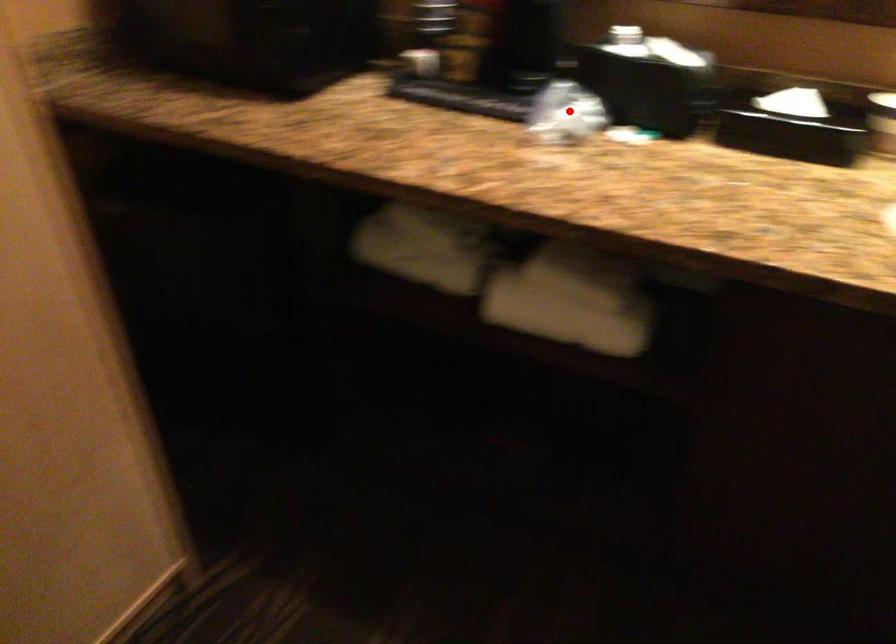
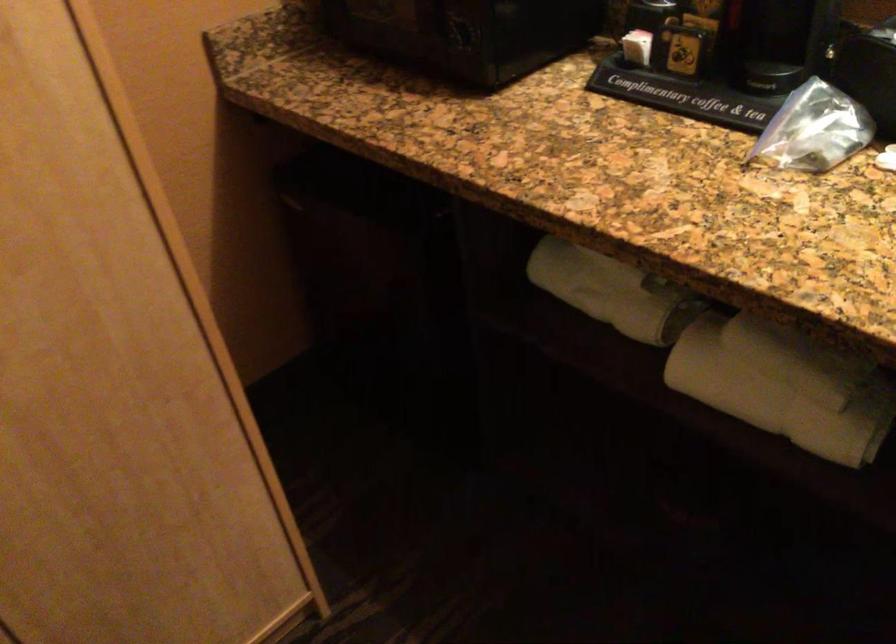
In the second image, find the point that corresponds to the highlighted location in the first image.

(814, 129)